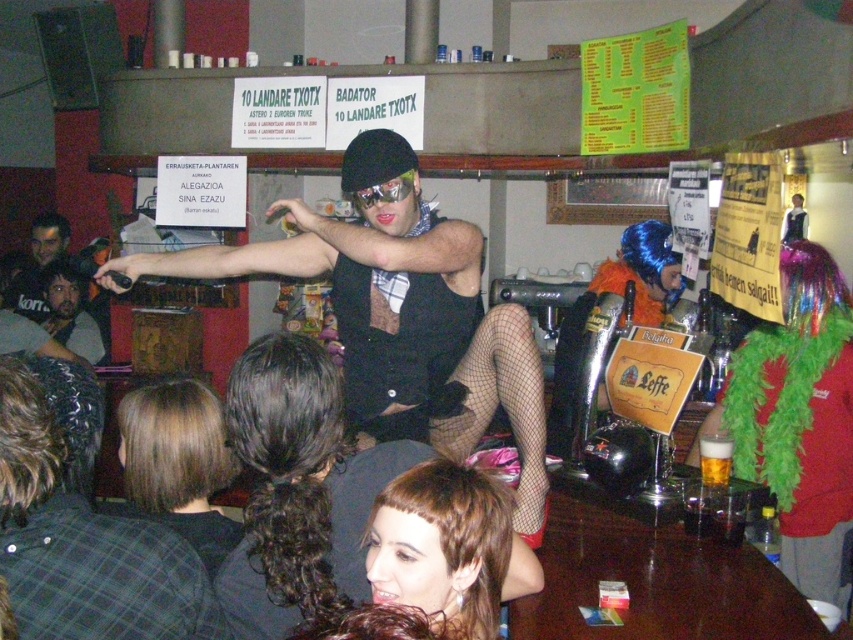
You are standing in the bar and want to reach a specific point to grab a drink. The point is located at coordinates point (190,484). Considering your height is 1.7 meters, can you comfortably reach that point without standing on something?

The distance of point (190,484) from viewer is 1.74 meters. Since the point is 1.74 meters away and your height is 1.7 meters, you can comfortably reach it without needing to stand on something as the distance is slightly beyond your height but within a reachable range.

Based on the photo, you are a photographer trying to capture the perfect shot of the lively scene in the bar. You notice a point labeled as point (178, 464) in your viewfinder. What object or feature is located at this coordinate?

The point (178, 464) marks the location of the blonde hair at lower left.